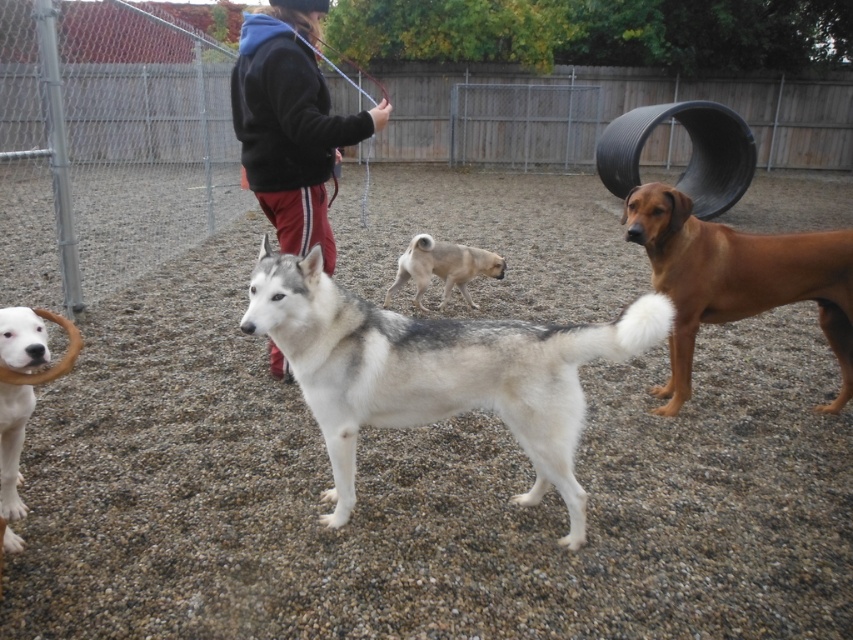
Question: Where is brown glossy dog at right located in relation to white fur dog at lower left in the image?

Choices:
 (A) right
 (B) left

Answer: (A)

Question: Which of the following is the farthest from the observer?

Choices:
 (A) black fleece jacket at center
 (B) white fur dog at lower left

Answer: (A)

Question: Is brown glossy dog at right below black fleece jacket at center?

Choices:
 (A) no
 (B) yes

Answer: (B)

Question: In this image, where is white fur dog at center located relative to white fur dog at lower left?

Choices:
 (A) below
 (B) above

Answer: (B)

Question: Which of the following is the closest to the observer?

Choices:
 (A) (451, 276)
 (B) (392, 324)
 (C) (231, 93)

Answer: (B)

Question: Which point is farther to the camera?

Choices:
 (A) white fur dog at lower left
 (B) white fur dog at center
 (C) light brown fur at center
 (D) black fleece jacket at center

Answer: (C)